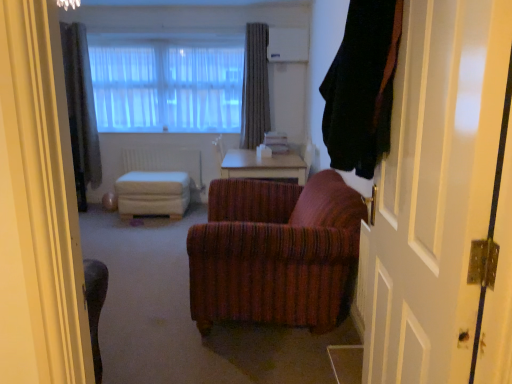
I want to click on free space on the front side of white fabric ottoman at center, so click(x=135, y=223).